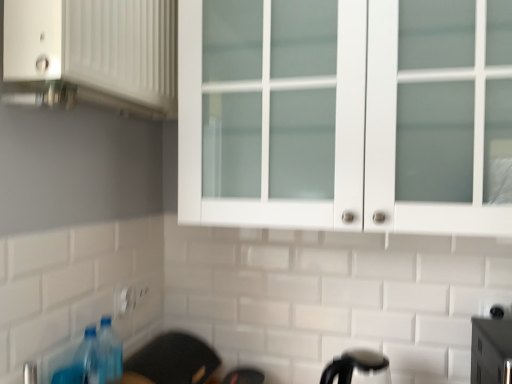
Question: Is black plastic kettle at lower center looking in the opposite direction of blue plastic bottle at lower left?

Choices:
 (A) no
 (B) yes

Answer: (A)

Question: Can you confirm if black plastic kettle at lower center is bigger than blue plastic bottle at lower left?

Choices:
 (A) yes
 (B) no

Answer: (A)

Question: Can you confirm if black plastic kettle at lower center is smaller than blue plastic bottle at lower left?

Choices:
 (A) no
 (B) yes

Answer: (A)

Question: From a real-world perspective, does black plastic kettle at lower center stand above blue plastic bottle at lower left?

Choices:
 (A) no
 (B) yes

Answer: (A)

Question: From the image's perspective, is black plastic kettle at lower center under blue plastic bottle at lower left?

Choices:
 (A) yes
 (B) no

Answer: (A)

Question: Visually, is white plastic electric outlet at lower center positioned to the left or to the right of white matte cabinet at upper left?

Choices:
 (A) right
 (B) left

Answer: (B)

Question: Is white plastic electric outlet at lower center bigger or smaller than white matte cabinet at upper left?

Choices:
 (A) big
 (B) small

Answer: (B)

Question: Is point (129, 302) closer or farther from the camera than point (47, 1)?

Choices:
 (A) closer
 (B) farther

Answer: (B)

Question: From the image's perspective, relative to white matte cabinet at upper left, is white plastic electric outlet at lower center above or below?

Choices:
 (A) above
 (B) below

Answer: (B)

Question: In the image, is white plastic electric outlet at lower center positioned in front of or behind white glass cabinet at upper center?

Choices:
 (A) front
 (B) behind

Answer: (B)

Question: From the image's perspective, is white plastic electric outlet at lower center above or below white glass cabinet at upper center?

Choices:
 (A) above
 (B) below

Answer: (B)

Question: In terms of height, does white plastic electric outlet at lower center look taller or shorter compared to white glass cabinet at upper center?

Choices:
 (A) short
 (B) tall

Answer: (A)

Question: Considering the positions of white plastic electric outlet at lower center and white glass cabinet at upper center in the image, is white plastic electric outlet at lower center bigger or smaller than white glass cabinet at upper center?

Choices:
 (A) small
 (B) big

Answer: (A)

Question: Is white matte cabinet at upper left spatially inside white plastic electric outlet at lower center, or outside of it?

Choices:
 (A) outside
 (B) inside

Answer: (A)

Question: From a real-world perspective, is white matte cabinet at upper left physically located above or below white plastic electric outlet at lower center?

Choices:
 (A) below
 (B) above

Answer: (B)